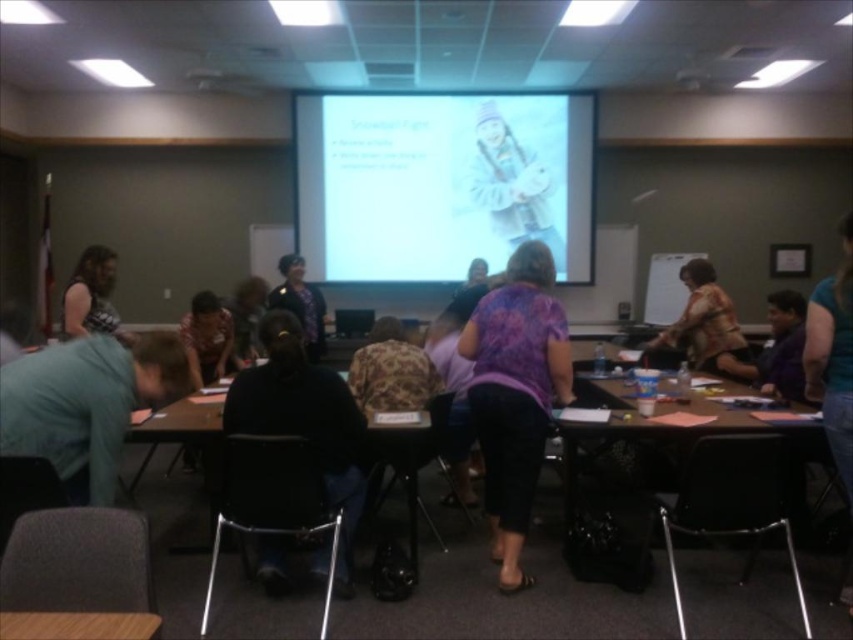
Can you confirm if wooden table at center is positioned above dark purple shirt at center?

No, wooden table at center is not above dark purple shirt at center.

Is wooden table at center closer to the viewer compared to dark purple shirt at center?

Yes, it is in front of dark purple shirt at center.

Is point (567, 477) positioned behind point (299, 289)?

No, (567, 477) is in front of (299, 289).

Find the location of a particular element. The height and width of the screenshot is (640, 853). wooden table at center is located at coordinates (622, 483).

What do you see at coordinates (85, 404) in the screenshot? I see `green matte shirt at lower left` at bounding box center [85, 404].

Does green matte shirt at lower left come in front of dark purple shirt at center?

Yes, it is in front of dark purple shirt at center.

The image size is (853, 640). Describe the element at coordinates (85, 404) in the screenshot. I see `green matte shirt at lower left` at that location.

Find the location of `green matte shirt at lower left`. green matte shirt at lower left is located at coordinates [x=85, y=404].

Who is more forward, (579, 448) or (692, 266)?

Point (579, 448)

Identify the location of wooden table at center. (622, 483).